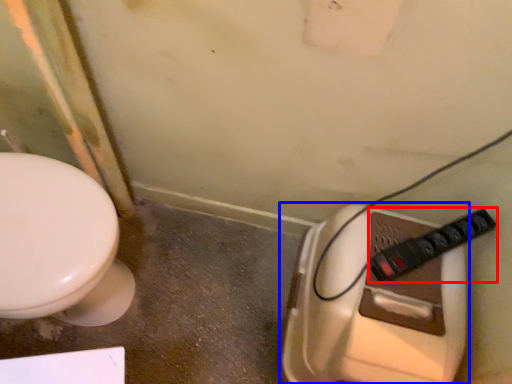
Question: Which point is closer to the camera, plug (highlighted by a red box) or toilet (highlighted by a blue box)?

Choices:
 (A) plug
 (B) toilet

Answer: (B)